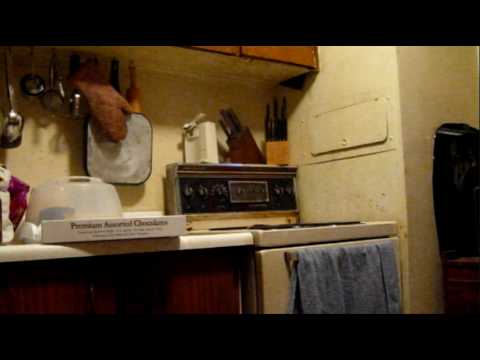
Where is `oven`? The width and height of the screenshot is (480, 360). oven is located at coordinates (x=277, y=240), (x=371, y=230), (x=273, y=267), (x=276, y=283).